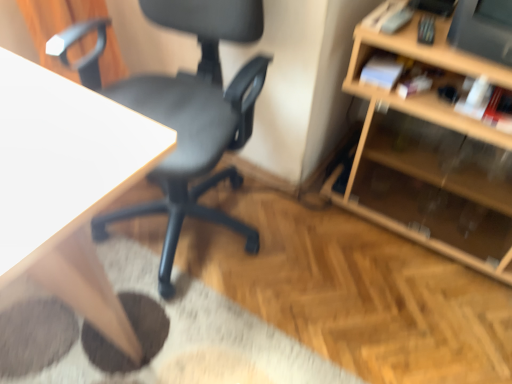
Question: Can you confirm if wooden shelf at right is smaller than black plastic chair at center?

Choices:
 (A) yes
 (B) no

Answer: (A)

Question: Considering the relative sizes of wooden shelf at right and black plastic chair at center in the image provided, is wooden shelf at right bigger than black plastic chair at center?

Choices:
 (A) yes
 (B) no

Answer: (B)

Question: From a real-world perspective, is wooden shelf at right positioned over black plastic chair at center based on gravity?

Choices:
 (A) yes
 (B) no

Answer: (B)

Question: Does wooden shelf at right have a greater width compared to black plastic chair at center?

Choices:
 (A) yes
 (B) no

Answer: (B)

Question: From the image's perspective, is wooden shelf at right located beneath black plastic chair at center?

Choices:
 (A) yes
 (B) no

Answer: (A)

Question: From a real-world perspective, relative to wooden shelf at right, is black plastic chair at center vertically above or below?

Choices:
 (A) above
 (B) below

Answer: (A)

Question: In terms of height, does black plastic chair at center look taller or shorter compared to wooden shelf at right?

Choices:
 (A) tall
 (B) short

Answer: (A)

Question: Based on their positions, is black plastic chair at center located to the left or right of wooden shelf at right?

Choices:
 (A) right
 (B) left

Answer: (B)

Question: From the image's perspective, relative to wooden shelf at right, is black plastic chair at center above or below?

Choices:
 (A) below
 (B) above

Answer: (B)

Question: Considering the relative positions of white wood desk at upper left and black plastic chair at center in the image provided, is white wood desk at upper left to the left or to the right of black plastic chair at center?

Choices:
 (A) right
 (B) left

Answer: (B)

Question: From their relative heights in the image, would you say white wood desk at upper left is taller or shorter than black plastic chair at center?

Choices:
 (A) tall
 (B) short

Answer: (B)

Question: From a real-world perspective, is white wood desk at upper left above or below black plastic chair at center?

Choices:
 (A) above
 (B) below

Answer: (B)

Question: From the image's perspective, is white wood desk at upper left located above or below black plastic chair at center?

Choices:
 (A) below
 (B) above

Answer: (A)

Question: Considering the positions of wooden shelf at right and white wood desk at upper left in the image, is wooden shelf at right taller or shorter than white wood desk at upper left?

Choices:
 (A) short
 (B) tall

Answer: (A)

Question: Is wooden shelf at right wider or thinner than white wood desk at upper left?

Choices:
 (A) thin
 (B) wide

Answer: (A)